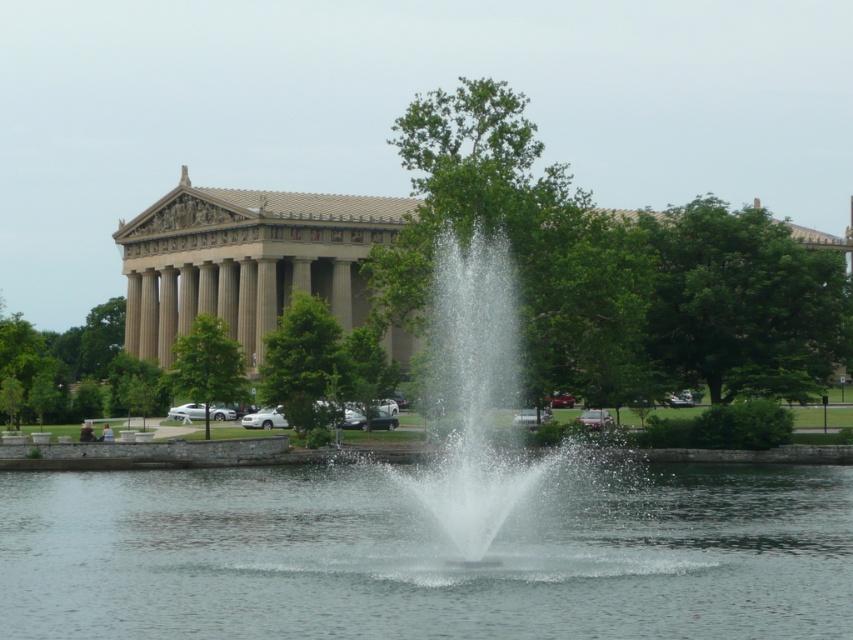
You are standing in front of the classical building and see the clear water at center and the clear water fountain at center. Which object is located lower in the image?

The clear water at center is located lower than the clear water fountain at center according to the description.

You are designing a garden layout and need to place a statue that is 2 meters wide. You have two options for placement locations based on the scene description. The first option is next to the clear water at center, and the second is next to the clear water fountain at center. Which location would allow the statue to fit better without overcrowding the area?

The clear water at center has a larger width than the clear water fountain at center, so placing the statue next to the clear water at center would provide more space and prevent overcrowding.